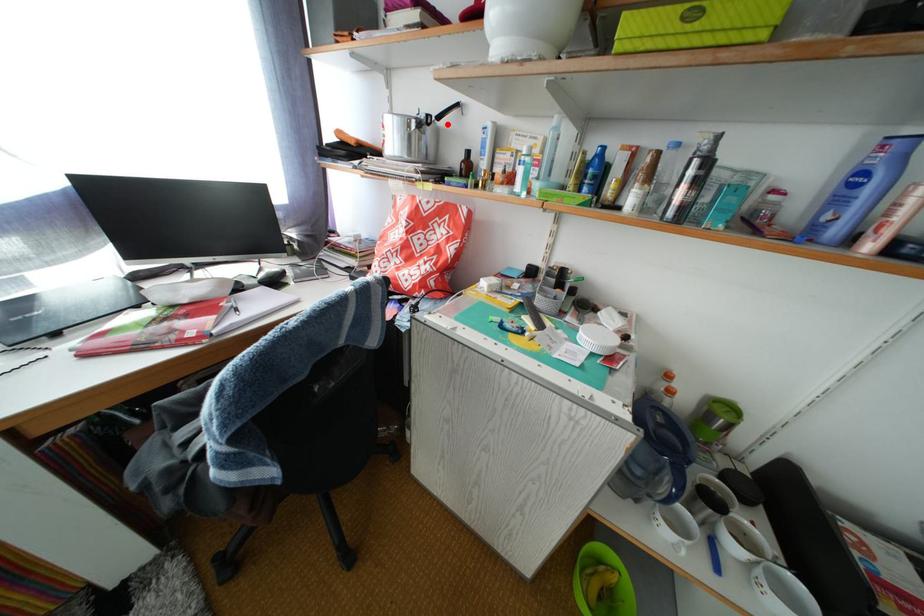
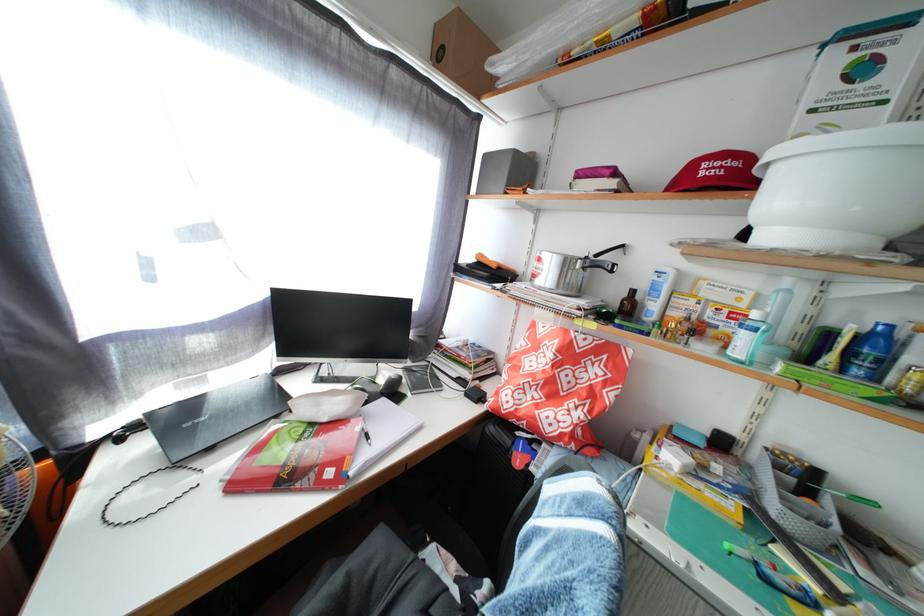
Locate, in the second image, the point that corresponds to the highlighted location in the first image.

(605, 262)